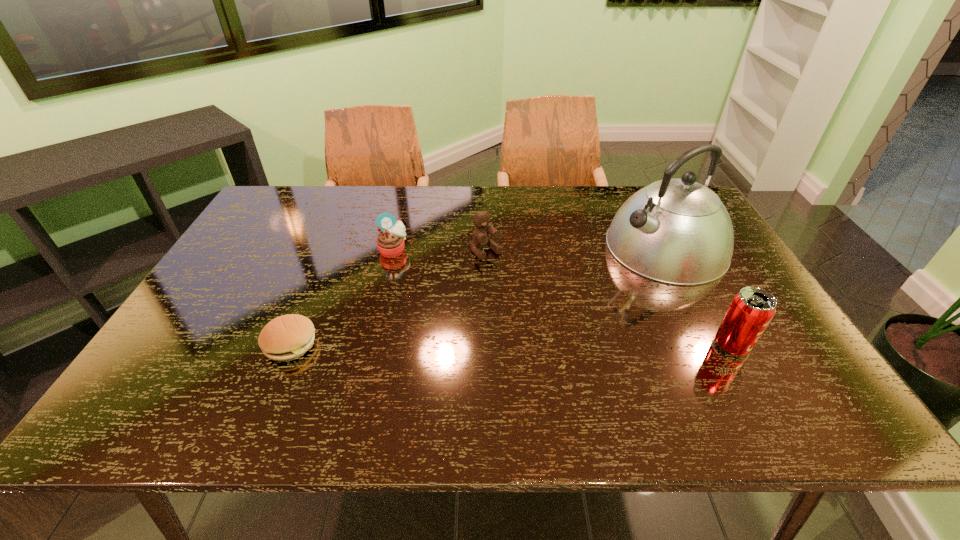
The height and width of the screenshot is (540, 960). Identify the location of free spot on the desktop that is between the leftmost object and the soda can and is positioned on the face of the third object from left to right. (568, 345).

Locate an element on the screen. The height and width of the screenshot is (540, 960). free spot on the desktop that is between the patty and the fourth shortest object and is positioned on the front-facing side of the second object from left to right is located at coordinates (489, 345).

Where is `vacant spot on the desktop that is between the leftmost object and the soda can and is positioned from the spout of the tallest object`? This screenshot has width=960, height=540. vacant spot on the desktop that is between the leftmost object and the soda can and is positioned from the spout of the tallest object is located at coordinates (476, 345).